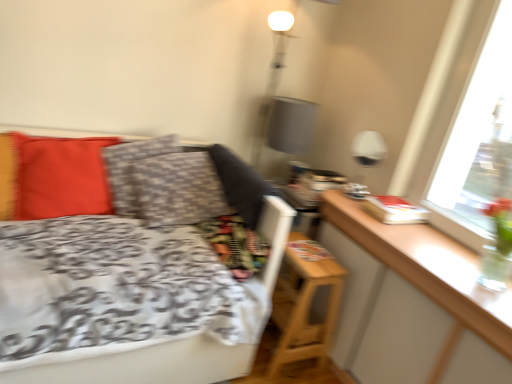
Question: Is patterned fabric pillow at center, acting as the 2th pillow starting from the left, to the left or to the right of wooden table at right in the image?

Choices:
 (A) right
 (B) left

Answer: (B)

Question: From a real-world perspective, is patterned fabric pillow at center, acting as the 2th pillow starting from the left, above or below wooden table at right?

Choices:
 (A) below
 (B) above

Answer: (A)

Question: Estimate the real-world distances between objects in this image. Which object is closer to the wooden table at right?

Choices:
 (A) wooden nightstand at lower right
 (B) matte red pillow at left, the first pillow viewed from the left
 (C) white glossy table lamp at upper right
 (D) patterned fabric pillow at center, acting as the 2th pillow starting from the left

Answer: (A)

Question: Based on their relative distances, which object is nearer to the wooden table at right?

Choices:
 (A) patterned fabric pillow at center, which appears as the 1th pillow when viewed from the right
 (B) white glossy table lamp at upper right
 (C) wooden nightstand at lower right
 (D) matte red pillow at left, the first pillow viewed from the left

Answer: (C)